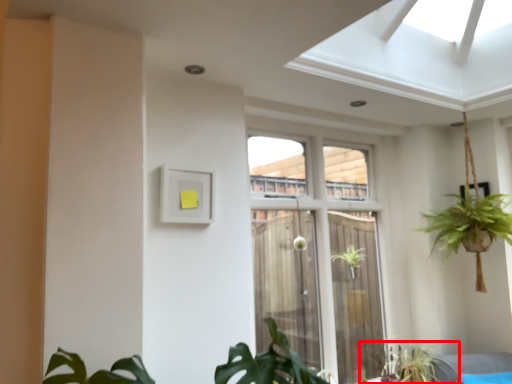
Question: From the image's perspective, where is houseplant (annotated by the red box) located in relation to window in the image?

Choices:
 (A) above
 (B) below

Answer: (B)